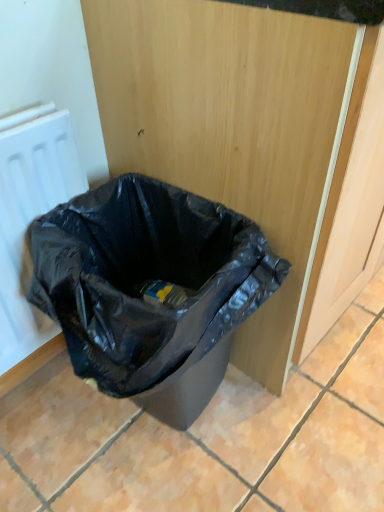
Image resolution: width=384 pixels, height=512 pixels. In order to click on free space between black plastic bag at lower left and white matte radiator at left in this screenshot , I will do `click(66, 447)`.